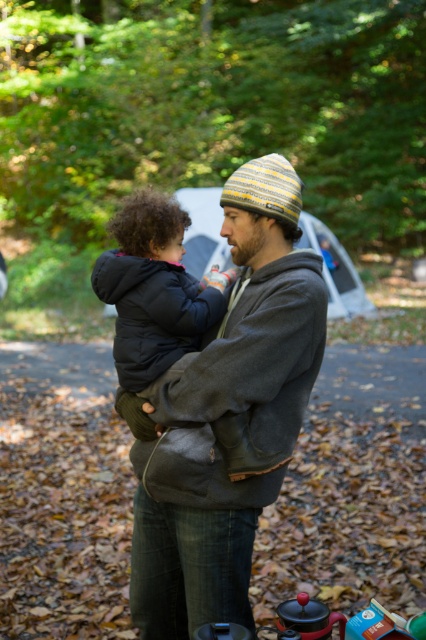
You are a fashion designer observing two clothing items in the image. The gray fleece hoodie at center and the dark gray puffy coat at center. Which clothing item has a larger width?

The gray fleece hoodie at center has a larger width than the dark gray puffy coat at center according to the description.

You are a fashion designer observing the scene. You notice the gray fleece hoodie at center and the dark gray puffy coat at center. Which clothing item has a larger size?

The gray fleece hoodie at center is bigger than the dark gray puffy coat at center, so the gray fleece hoodie at center has a larger size.